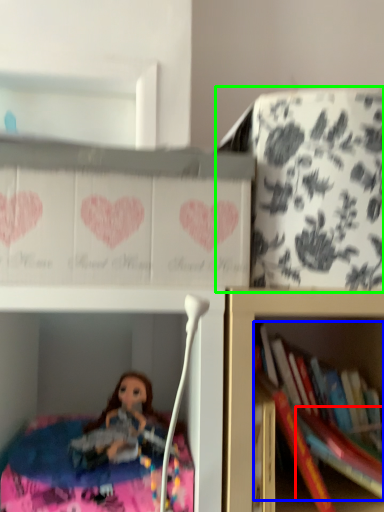
Question: Considering the real-world distances, which object is closest to book (highlighted by a red box)? book (highlighted by a blue box) or cabinet (highlighted by a green box).

Choices:
 (A) book
 (B) cabinet

Answer: (A)